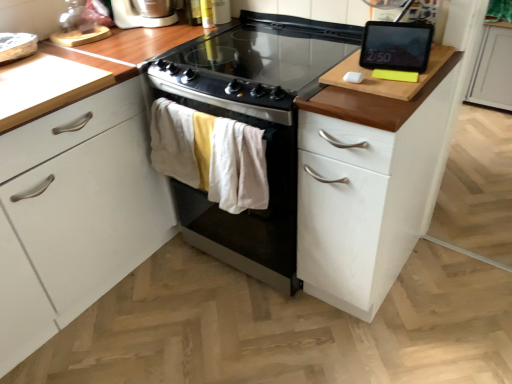
Question: Does black glass-top oven at center lie in front of white wood cabinet at right?

Choices:
 (A) no
 (B) yes

Answer: (A)

Question: Is black glass-top oven at center not inside white wood cabinet at right?

Choices:
 (A) yes
 (B) no

Answer: (A)

Question: From the image's perspective, is black glass-top oven at center beneath white wood cabinet at right?

Choices:
 (A) no
 (B) yes

Answer: (A)

Question: Is black glass-top oven at center in contact with white wood cabinet at right?

Choices:
 (A) yes
 (B) no

Answer: (B)

Question: Are black glass-top oven at center and white wood cabinet at right far apart?

Choices:
 (A) no
 (B) yes

Answer: (A)

Question: Is black glass-top oven at center aimed at white wood cabinet at right?

Choices:
 (A) yes
 (B) no

Answer: (B)

Question: Does white wood cabinet at right have a lesser height compared to black glass cooktop at center?

Choices:
 (A) yes
 (B) no

Answer: (B)

Question: Is white wood cabinet at right facing away from black glass cooktop at center?

Choices:
 (A) no
 (B) yes

Answer: (A)

Question: Is white wood cabinet at right taller than black glass cooktop at center?

Choices:
 (A) no
 (B) yes

Answer: (B)

Question: From a real-world perspective, is white wood cabinet at right under black glass cooktop at center?

Choices:
 (A) no
 (B) yes

Answer: (B)

Question: Is white wood cabinet at right at the right side of black glass cooktop at center?

Choices:
 (A) yes
 (B) no

Answer: (A)

Question: Considering the relative positions of white wood cabinet at right and black glass cooktop at center in the image provided, is white wood cabinet at right behind black glass cooktop at center?

Choices:
 (A) no
 (B) yes

Answer: (A)

Question: Is black glossy tablet at upper right facing away from white plastic toaster at upper left?

Choices:
 (A) no
 (B) yes

Answer: (A)